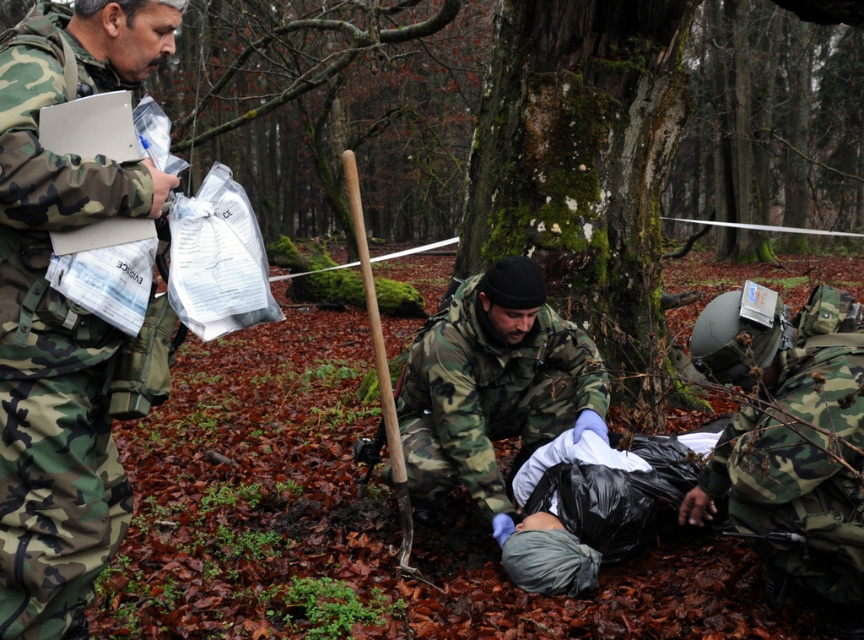
Is camo uniform at lower right thinner than camouflage uniform at center?

Yes, camo uniform at lower right is thinner than camouflage uniform at center.

Can you confirm if camo uniform at lower right is positioned below camouflage uniform at center?

Indeed, camo uniform at lower right is positioned under camouflage uniform at center.

Who is more distant from viewer, (843, 458) or (465, 380)?

Positioned behind is point (465, 380).

At what (x,y) coordinates should I click in order to perform the action: click on camo uniform at lower right. Please return your answer as a coordinate pair (x, y). The width and height of the screenshot is (864, 640). Looking at the image, I should click on (793, 449).

Is the position of camouflage uniform at left more distant than that of camo uniform at lower right?

No.

Which is behind, point (59, 29) or point (824, 298)?

The point (824, 298) is more distant.

The height and width of the screenshot is (640, 864). Describe the element at coordinates (62, 308) in the screenshot. I see `camouflage uniform at left` at that location.

Locate an element on the screen. camouflage uniform at left is located at coordinates (62, 308).

Does camouflage uniform at left appear on the left side of camouflage uniform at center?

Yes, camouflage uniform at left is to the left of camouflage uniform at center.

Is camouflage uniform at left above camouflage uniform at center?

Indeed, camouflage uniform at left is positioned over camouflage uniform at center.

The height and width of the screenshot is (640, 864). Find the location of `camouflage uniform at left`. camouflage uniform at left is located at coordinates (62, 308).